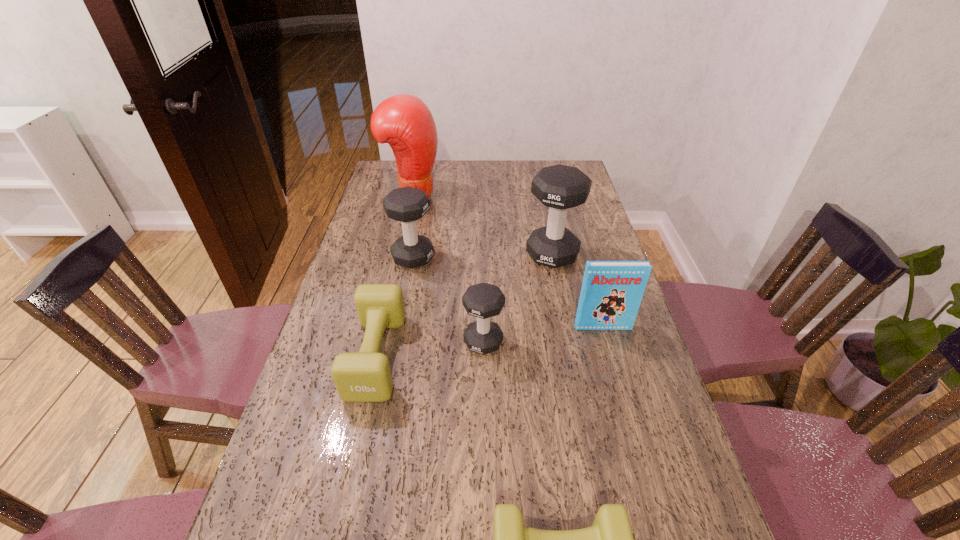
Locate an element on the screen. The width and height of the screenshot is (960, 540). unoccupied area between the blue book and the farthest object is located at coordinates (508, 262).

You are a GUI agent. You are given a task and a screenshot of the screen. Output one action in this format:
    pyautogui.click(x=<x>, y=<y>)
    Task: Click on the empty location between the book and the leftmost gray dumbbell
    
    Given the screenshot: What is the action you would take?
    pyautogui.click(x=508, y=293)

You are a GUI agent. You are given a task and a screenshot of the screen. Output one action in this format:
    pyautogui.click(x=<x>, y=<y>)
    Task: Click on the object that is the fourth closest to the rightmost gray dumbbell
    
    Given the screenshot: What is the action you would take?
    tap(404, 121)

I want to click on the sixth closest object relative to the farthest object, so click(610, 539).

Point out which dumbbell is positioned as the third nearest to the smaller olive dumbbell. Please provide its 2D coordinates. Your answer should be formatted as a tuple, i.e. [(x, y)], where the tuple contains the x and y coordinates of a point satisfying the conditions above.

[(559, 187)]

At what (x,y) coordinates should I click in order to perform the action: click on dumbbell that stands as the fourth closest to the third tallest dumbbell. Please return your answer as a coordinate pair (x, y). Looking at the image, I should click on (610, 539).

The image size is (960, 540). I want to click on the closest gray dumbbell to the rightmost gray dumbbell, so click(483, 300).

Locate which gray dumbbell is the third closest to the second shortest dumbbell. Please provide its 2D coordinates. Your answer should be formatted as a tuple, i.e. [(x, y)], where the tuple contains the x and y coordinates of a point satisfying the conditions above.

[(559, 187)]

Image resolution: width=960 pixels, height=540 pixels. I want to click on olive dumbbell object that ranks as the second closest to the red boxing glove, so click(610, 539).

Locate an element on the screen. This screenshot has width=960, height=540. the second closest olive dumbbell to the tallest object is located at coordinates (610, 539).